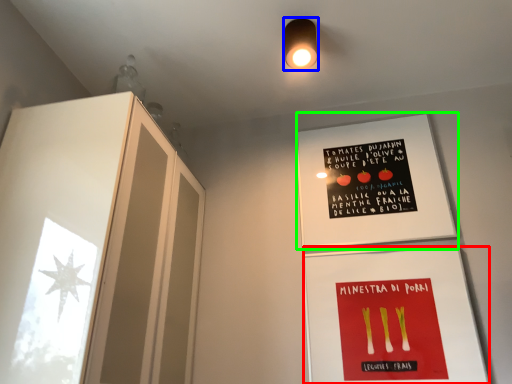
Question: Estimate the real-world distances between objects in this image. Which object is farther from flyer (highlighted by a red box), light fixture (highlighted by a blue box) or bulletin board (highlighted by a green box)?

Choices:
 (A) light fixture
 (B) bulletin board

Answer: (A)